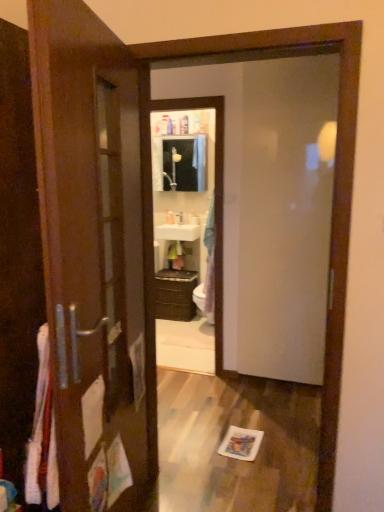
Question: From a real-world perspective, is white glossy sink at center below matte white medicine cabinet at center?

Choices:
 (A) yes
 (B) no

Answer: (A)

Question: Is matte white medicine cabinet at center a part of white glossy sink at center?

Choices:
 (A) no
 (B) yes

Answer: (A)

Question: Is white glossy sink at center looking in the opposite direction of matte white medicine cabinet at center?

Choices:
 (A) no
 (B) yes

Answer: (A)

Question: Is white glossy sink at center far away from matte white medicine cabinet at center?

Choices:
 (A) no
 (B) yes

Answer: (A)

Question: Does white glossy sink at center come behind matte white medicine cabinet at center?

Choices:
 (A) no
 (B) yes

Answer: (A)

Question: Considering the positions of transparent glass door at center and matte white medicine cabinet at center in the image, is transparent glass door at center wider or thinner than matte white medicine cabinet at center?

Choices:
 (A) thin
 (B) wide

Answer: (A)

Question: Does point (291, 263) appear closer or farther from the camera than point (163, 144)?

Choices:
 (A) closer
 (B) farther

Answer: (A)

Question: In terms of size, does transparent glass door at center appear bigger or smaller than matte white medicine cabinet at center?

Choices:
 (A) big
 (B) small

Answer: (A)

Question: Is transparent glass door at center taller or shorter than matte white medicine cabinet at center?

Choices:
 (A) short
 (B) tall

Answer: (B)

Question: Is point (182, 280) closer or farther from the camera than point (266, 324)?

Choices:
 (A) farther
 (B) closer

Answer: (A)

Question: Is brown matte cabinet at center situated inside transparent glass door at center or outside?

Choices:
 (A) inside
 (B) outside

Answer: (B)

Question: From a real-world perspective, is brown matte cabinet at center physically located above or below transparent glass door at center?

Choices:
 (A) above
 (B) below

Answer: (B)

Question: Considering the relative positions of brown matte cabinet at center and transparent glass door at center in the image provided, is brown matte cabinet at center to the left or to the right of transparent glass door at center?

Choices:
 (A) left
 (B) right

Answer: (A)

Question: Considering the positions of point (168, 211) and point (314, 217), is point (168, 211) closer or farther from the camera than point (314, 217)?

Choices:
 (A) closer
 (B) farther

Answer: (B)

Question: In the image, is white glossy soap dispenser at center on the left side or the right side of transparent glass door at center?

Choices:
 (A) left
 (B) right

Answer: (A)